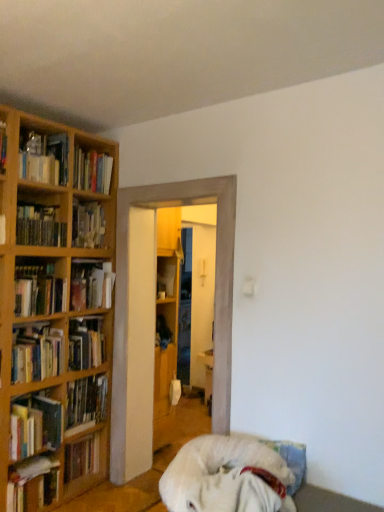
Question: Can you confirm if white fluffy dog at lower center is thinner than hardcover book at left, acting as the eighth book starting from the top?

Choices:
 (A) yes
 (B) no

Answer: (B)

Question: Is white fluffy dog at lower center not within hardcover book at left, acting as the eighth book starting from the top?

Choices:
 (A) yes
 (B) no

Answer: (A)

Question: From the image's perspective, does white fluffy dog at lower center appear higher than hardcover book at left, the 4th book from the bottom?

Choices:
 (A) yes
 (B) no

Answer: (B)

Question: Is white fluffy dog at lower center positioned with its back to hardcover book at left, acting as the eighth book starting from the top?

Choices:
 (A) no
 (B) yes

Answer: (A)

Question: From the image's perspective, would you say white fluffy dog at lower center is shown under hardcover book at left, the 4th book from the bottom?

Choices:
 (A) no
 (B) yes

Answer: (B)

Question: Considering the relative positions of white fluffy dog at lower center and hardcover book at left, acting as the eighth book starting from the top, in the image provided, is white fluffy dog at lower center to the right of hardcover book at left, acting as the eighth book starting from the top, from the viewer's perspective?

Choices:
 (A) yes
 (B) no

Answer: (A)

Question: Does hardcover book at left, which appears as the 5th book when ordered from the bottom, appear on the left side of matte wooden bookshelf at left, marked as the 1th book in a top-to-bottom arrangement?

Choices:
 (A) yes
 (B) no

Answer: (B)

Question: Is hardcover book at left, which appears as the seventh book when viewed from the top, bigger than matte wooden bookshelf at left, the eleventh book positioned from the bottom?

Choices:
 (A) no
 (B) yes

Answer: (A)

Question: Is hardcover book at left, which appears as the seventh book when viewed from the top, aimed at matte wooden bookshelf at left, the eleventh book positioned from the bottom?

Choices:
 (A) yes
 (B) no

Answer: (B)

Question: From the image's perspective, is hardcover book at left, which appears as the seventh book when viewed from the top, below matte wooden bookshelf at left, the eleventh book positioned from the bottom?

Choices:
 (A) yes
 (B) no

Answer: (A)

Question: Is hardcover book at left, which appears as the seventh book when viewed from the top, turned away from matte wooden bookshelf at left, marked as the 1th book in a top-to-bottom arrangement?

Choices:
 (A) no
 (B) yes

Answer: (A)

Question: Is hardcover book at left, which appears as the 5th book when ordered from the bottom, further to the viewer compared to matte wooden bookshelf at left, marked as the 1th book in a top-to-bottom arrangement?

Choices:
 (A) yes
 (B) no

Answer: (B)

Question: Can you confirm if matte wooden bookshelf at left, the eleventh book positioned from the bottom, is bigger than hardcover book at left, arranged as the 9th book when viewed from the top?

Choices:
 (A) yes
 (B) no

Answer: (A)